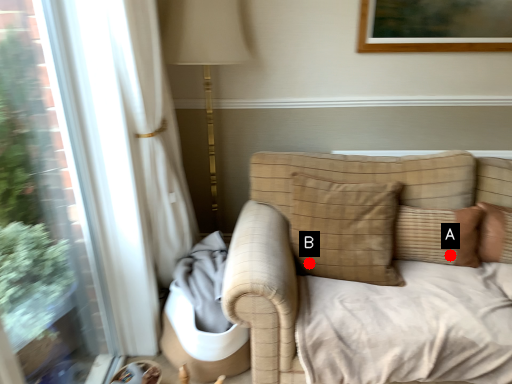
Question: Two points are circled on the image, labeled by A and B beside each circle. Which point appears farthest from the camera in this image?

Choices:
 (A) A is further
 (B) B is further

Answer: (A)